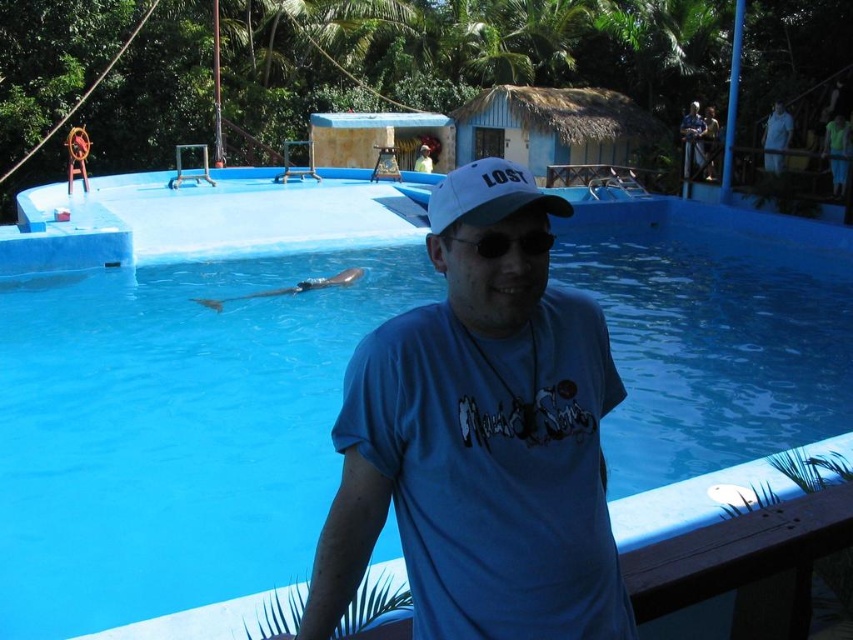
Is white fabric cap at center shorter than black plastic goggles at center?

No, white fabric cap at center is not shorter than black plastic goggles at center.

Is point (503, 164) farther from viewer compared to point (500, 244)?

Yes, it is.

This screenshot has height=640, width=853. In order to click on white fabric cap at center in this screenshot , I will do `click(486, 195)`.

Who is more distant from viewer, (390, 417) or (457, 193)?

The point (390, 417) is more distant.

Can you confirm if blue cotton shirt at center is positioned below white fabric cap at center?

Yes.

Image resolution: width=853 pixels, height=640 pixels. What do you see at coordinates (480, 440) in the screenshot?
I see `blue cotton shirt at center` at bounding box center [480, 440].

Where is `blue cotton shirt at center`? This screenshot has height=640, width=853. blue cotton shirt at center is located at coordinates (480, 440).

Can you confirm if blue cotton shirt at center is taller than black plastic goggles at center?

Yes, blue cotton shirt at center is taller than black plastic goggles at center.

Is point (437, 234) farther from viewer compared to point (503, 236)?

Yes.

Locate an element on the screen. blue cotton shirt at center is located at coordinates (480, 440).